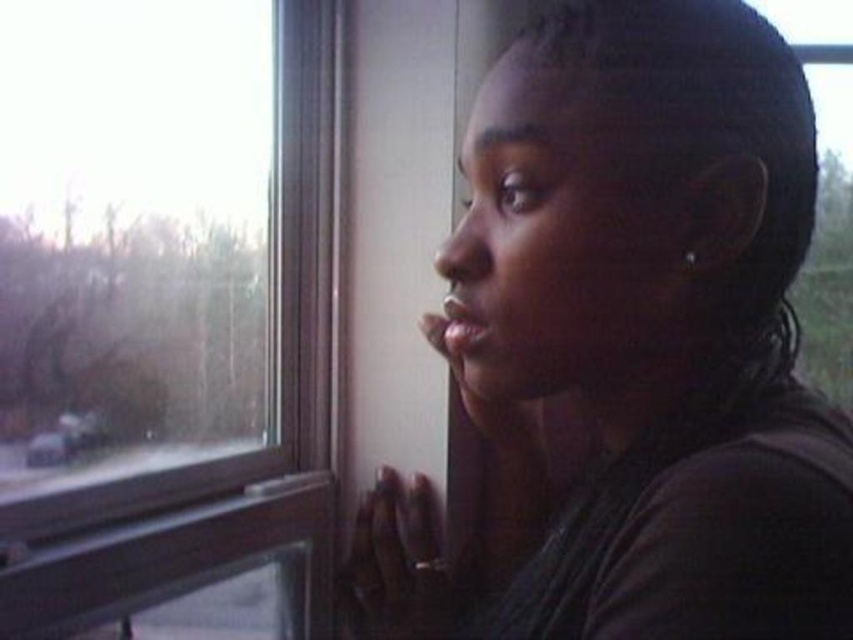
Does point (685, 129) come in front of point (288, 524)?

Yes.

Can you confirm if dark brown hair at upper right is smaller than transparent glass window at upper left?

No.

Image resolution: width=853 pixels, height=640 pixels. Find the location of `dark brown hair at upper right`. dark brown hair at upper right is located at coordinates (648, 328).